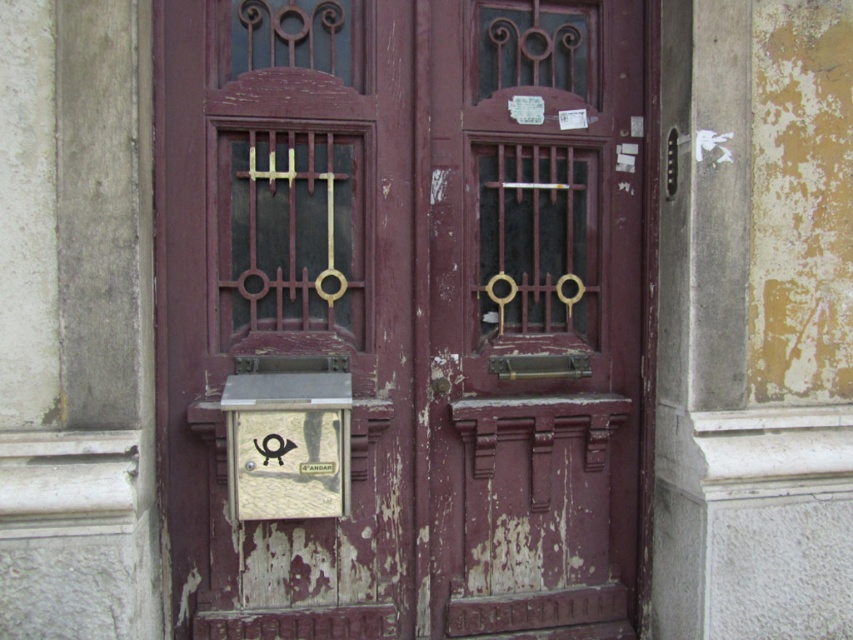
You are a mail carrier who needs to deliver a package to the address listed on the gold textured plaque at center. However, the rusty metal door at center is closed. Can you see the plaque through the door?

The gold textured plaque at center is behind the rusty metal door at center, so you cannot see it through the closed door.

You are a mail carrier holding a package that requires a signature. You notice two doors in front of you, the rusty wood door at center and the rusty metal door at center. The package must be delivered to the door that is farther from the other door. Which door should you deliver the package to?

Both doors are positioned at the same central location, so neither is farther from the other. Please verify the correct delivery address.

What is the significance of the point marked at coordinates [538,316] in the image?

The point marked at coordinates [538,316] indicates the location of the rusty metal door at the center of the image.